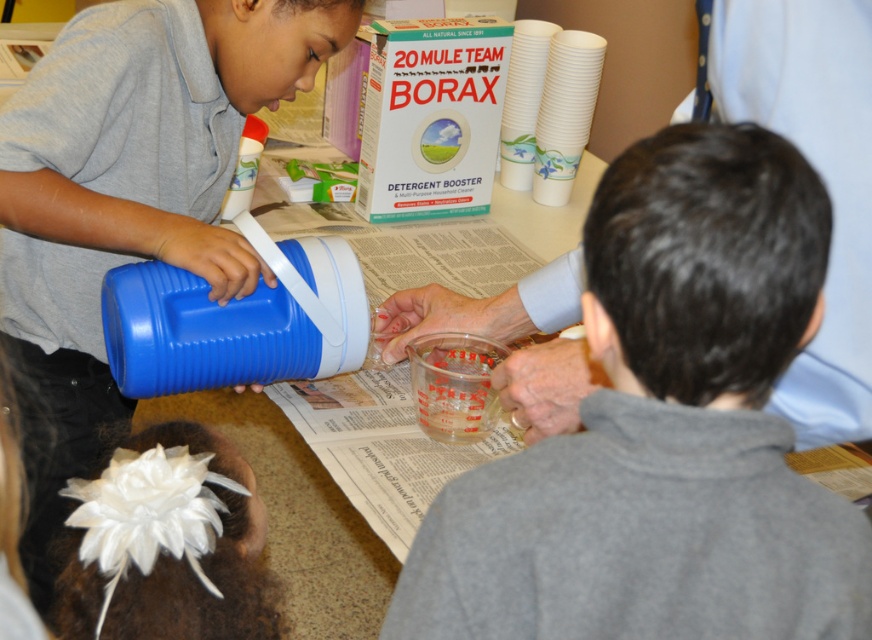
Is gray fleece sweatshirt at center below matte blue thermos at left?

Yes, gray fleece sweatshirt at center is below matte blue thermos at left.

Who is more forward, (815,180) or (69,301)?

Point (815,180) is in front.

The height and width of the screenshot is (640, 872). Identify the location of gray fleece sweatshirt at center. (665, 429).